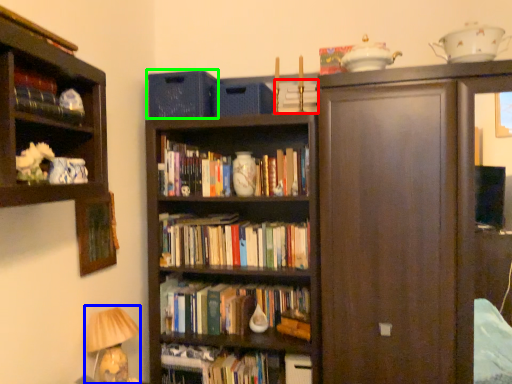
Question: Which object is the farthest from book (highlighted by a red box)? Choose among these: table lamp (highlighted by a blue box) or cabinetry (highlighted by a green box).

Choices:
 (A) table lamp
 (B) cabinetry

Answer: (A)